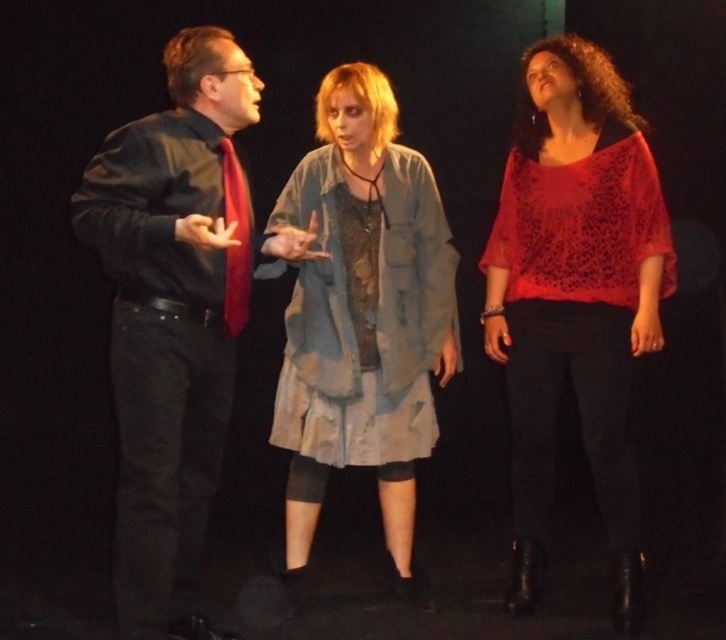
Question: Which point is closer to the camera?

Choices:
 (A) knitted red blouse at right
 (B) matte red tie at left
 (C) matte black shirt at left
 (D) distressed denim jacket at center

Answer: (C)

Question: Does matte black shirt at left appear under knitted red blouse at right?

Choices:
 (A) yes
 (B) no

Answer: (A)

Question: Is matte black shirt at left below distressed denim jacket at center?

Choices:
 (A) yes
 (B) no

Answer: (A)

Question: Which object appears farthest from the camera in this image?

Choices:
 (A) matte red tie at left
 (B) distressed denim jacket at center

Answer: (B)

Question: Can you confirm if matte black shirt at left is positioned above distressed denim jacket at center?

Choices:
 (A) yes
 (B) no

Answer: (B)

Question: Which object is closer to the camera taking this photo?

Choices:
 (A) matte red tie at left
 (B) matte black shirt at left

Answer: (B)